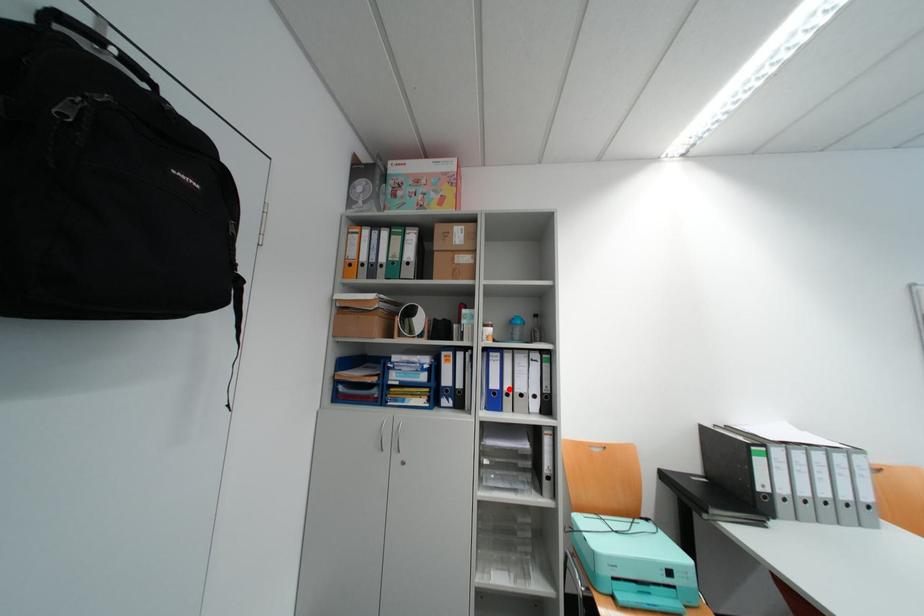
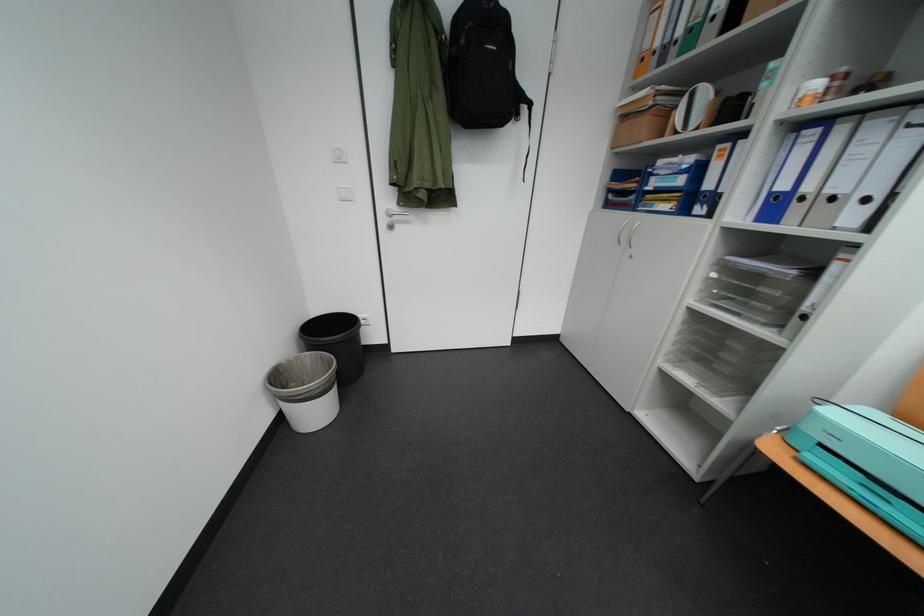
Locate, in the second image, the point that corresponds to the highlighted location in the first image.

(799, 190)